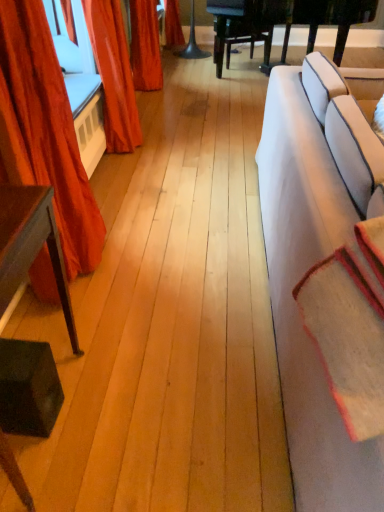
Question: Relative to beige woolen blanket at right, is dark brown wood table at left in front or behind?

Choices:
 (A) front
 (B) behind

Answer: (B)

Question: From their relative heights in the image, would you say dark brown wood table at left is taller or shorter than beige woolen blanket at right?

Choices:
 (A) tall
 (B) short

Answer: (A)

Question: Based on their relative distances, which object is nearer to the beige woolen blanket at right?

Choices:
 (A) velvet red curtain at left, the 1th curtain viewed from the front
 (B) velvet orange curtain at upper left, positioned as the second curtain in front-to-back order
 (C) dark brown wood table at left
 (D) white fabric couch at right

Answer: (D)

Question: Which object is positioned closest to the velvet red curtain at left, acting as the 2th curtain starting from the back?

Choices:
 (A) beige woolen blanket at right
 (B) dark brown wood table at left
 (C) velvet orange curtain at upper left, positioned as the second curtain in front-to-back order
 (D) white fabric couch at right

Answer: (B)